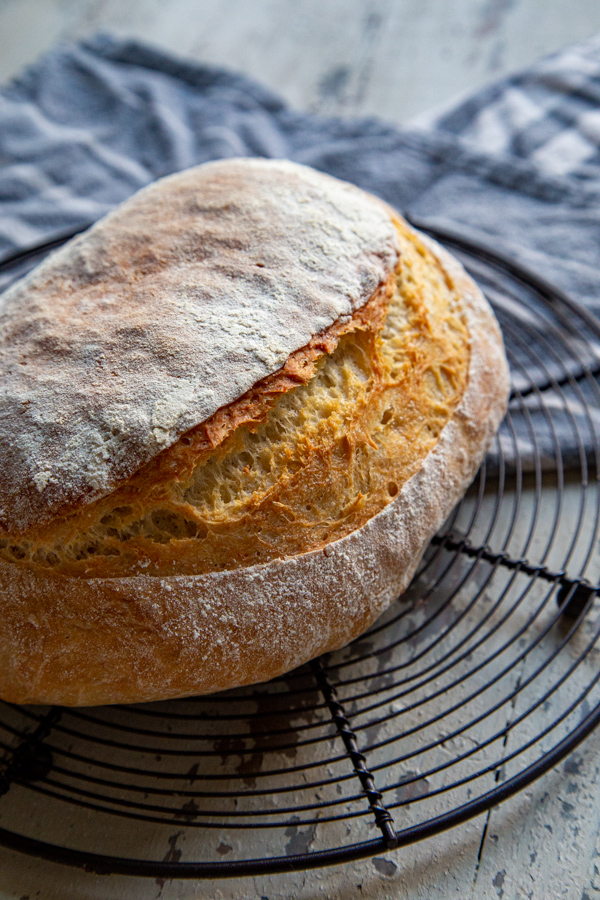
You are a GUI agent. You are given a task and a screenshot of the screen. Output one action in this format:
    pyautogui.click(x=<x>, y=<y>)
    Task: Click on the napkin
    The image size is (600, 900).
    Given the screenshot: What is the action you would take?
    pyautogui.click(x=525, y=446)